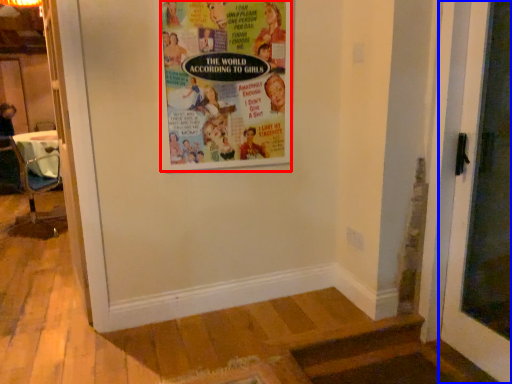
Question: Which of the following is the closest to the observer, poster (highlighted by a red box) or door (highlighted by a blue box)?

Choices:
 (A) poster
 (B) door

Answer: (B)